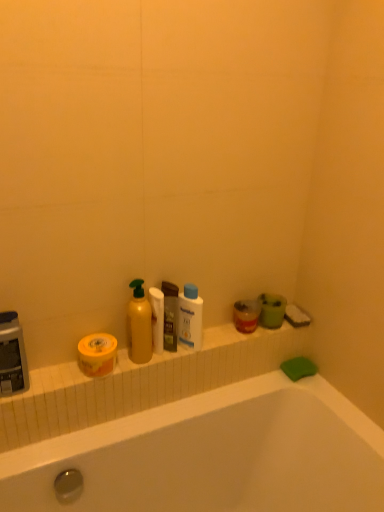
Question: Considering the positions of point (99, 334) and point (155, 304), is point (99, 334) closer or farther from the camera than point (155, 304)?

Choices:
 (A) closer
 (B) farther

Answer: (A)

Question: Would you say yellow matte jar at left, which is the 1th mouthwash from left to right, is to the left or to the right of white matte toilet paper at center in the picture?

Choices:
 (A) left
 (B) right

Answer: (A)

Question: Which object is positioned closest to the white plastic bottle at center, arranged as the 2th cleaning product when viewed from the left?

Choices:
 (A) yellow matte jar at left, which is the 1th mouthwash from left to right
 (B) white matte toilet paper at center
 (C) translucent plastic mouthwash at center, marked as the second mouthwash in a left-to-right arrangement
 (D) yellow matte bottle at center, which appears as the second cleaning product when viewed from the right

Answer: (C)

Question: Which of these objects is positioned farthest from the yellow matte bottle at center, positioned as the first cleaning product in left-to-right order?

Choices:
 (A) white plastic bottle at center, arranged as the 2th cleaning product when viewed from the left
 (B) yellow matte jar at left, which ranks as the second mouthwash in right-to-left order
 (C) translucent plastic mouthwash at center, marked as the second mouthwash in a left-to-right arrangement
 (D) white matte toilet paper at center

Answer: (A)